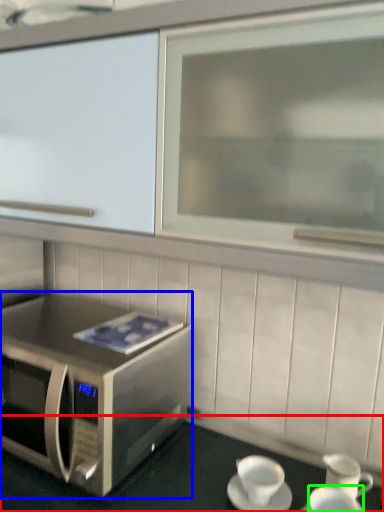
Question: Considering the real-world distances, which object is farthest from table (highlighted by a red box)? microwave oven (highlighted by a blue box) or coffee cup (highlighted by a green box)?

Choices:
 (A) microwave oven
 (B) coffee cup

Answer: (B)